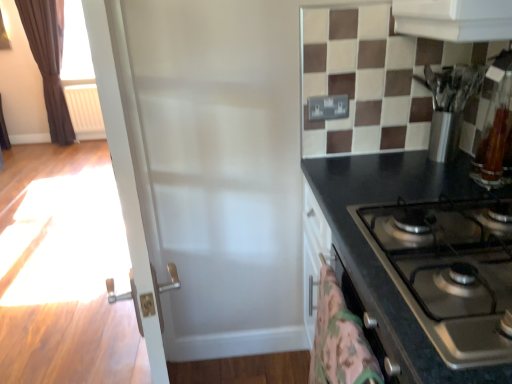
This screenshot has width=512, height=384. In order to click on white glossy door at center in this screenshot , I will do `click(126, 158)`.

What do you see at coordinates (377, 258) in the screenshot?
I see `black glossy countertop at right` at bounding box center [377, 258].

Identify the location of fluffy pink blanket at lower right. Image resolution: width=512 pixels, height=384 pixels. (340, 340).

You are a GUI agent. You are given a task and a screenshot of the screen. Output one action in this format:
    pyautogui.click(x=<x>, y=<y>)
    Task: Click on the stainless steel knife block at upper right
    
    Given the screenshot: What is the action you would take?
    pyautogui.click(x=449, y=105)

Considering the relative sizes of stainless steel knife block at upper right and fluffy pink blanket at lower right in the image provided, is stainless steel knife block at upper right bigger than fluffy pink blanket at lower right?

Yes.

Is stainless steel knife block at upper right looking in the opposite direction of fluffy pink blanket at lower right?

stainless steel knife block at upper right is not turned away from fluffy pink blanket at lower right.

From a real-world perspective, does stainless steel knife block at upper right sit lower than fluffy pink blanket at lower right?

Incorrect, from a real-world perspective, stainless steel knife block at upper right is higher than fluffy pink blanket at lower right.

Are white plastic radiator at left and fluffy pink blanket at lower right located far from each other?

Yes, white plastic radiator at left and fluffy pink blanket at lower right are quite far apart.

From the image's perspective, is white plastic radiator at left positioned above or below fluffy pink blanket at lower right?

From the image's perspective, white plastic radiator at left appears above fluffy pink blanket at lower right.

How distant is white plastic radiator at left from fluffy pink blanket at lower right?

white plastic radiator at left is 14.01 feet away from fluffy pink blanket at lower right.

Which is more to the right, white plastic radiator at left or fluffy pink blanket at lower right?

fluffy pink blanket at lower right is more to the right.

Between black glossy countertop at right and brown velvet curtain at left, which one has smaller width?

Thinner between the two is brown velvet curtain at left.

Is point (391, 319) closer to viewer compared to point (72, 128)?

Yes, it is.

Is black glossy countertop at right taller than brown velvet curtain at left?

In fact, black glossy countertop at right may be shorter than brown velvet curtain at left.

From a real-world perspective, which object rests below the other?

In real-world perspective, fluffy pink blanket at lower right is lower.

Could you tell me if fluffy pink blanket at lower right is turned towards white glossy door at center?

No, fluffy pink blanket at lower right is not facing towards white glossy door at center.

Can you tell me how much fluffy pink blanket at lower right and white glossy door at center differ in facing direction?

fluffy pink blanket at lower right and white glossy door at center are facing 13 degrees away from each other.

From the image's perspective, is fluffy pink blanket at lower right on white glossy door at center?

Actually, fluffy pink blanket at lower right appears below white glossy door at center in the image.

What's the angular difference between stainless steel knife block at upper right and black glossy countertop at right's facing directions?

They differ by 0.469 degrees in their facing directions.

Considering the sizes of stainless steel knife block at upper right and black glossy countertop at right in the image, is stainless steel knife block at upper right taller or shorter than black glossy countertop at right?

Considering their sizes, stainless steel knife block at upper right has less height than black glossy countertop at right.

Could you tell me if stainless steel knife block at upper right is facing black glossy countertop at right?

No, stainless steel knife block at upper right is not facing towards black glossy countertop at right.

Does stainless steel knife block at upper right have a smaller size compared to black glossy countertop at right?

Yes, stainless steel knife block at upper right is smaller than black glossy countertop at right.

Between black glossy countertop at right and white glossy door at center, which one is positioned in front?

Positioned in front is white glossy door at center.

Based on their sizes in the image, would you say black glossy countertop at right is bigger or smaller than white glossy door at center?

In the image, black glossy countertop at right appears to be larger than white glossy door at center.

From the picture: Does black glossy countertop at right have a greater width compared to white glossy door at center?

Yes, black glossy countertop at right is wider than white glossy door at center.

Are black glossy countertop at right and white glossy door at center beside each other?

black glossy countertop at right and white glossy door at center are clearly separated.

Which is more to the left, fluffy pink blanket at lower right or brown velvet curtain at left?

Positioned to the left is brown velvet curtain at left.

From the image's perspective, is fluffy pink blanket at lower right above or below brown velvet curtain at left?

fluffy pink blanket at lower right is below brown velvet curtain at left.

Does point (365, 363) appear closer or farther from the camera than point (53, 25)?

Point (365, 363) appears to be closer to the viewer than point (53, 25).

At what (x,y) coordinates should I click in order to perform the action: click on blanket below the stainless steel knife block at upper right (from the image's perspective). Please return your answer as a coordinate pair (x, y). Looking at the image, I should click on (340, 340).

The image size is (512, 384). Find the location of `blanket on the right of white plastic radiator at left`. blanket on the right of white plastic radiator at left is located at coordinates (340, 340).

Consider the image. Estimate the real-world distances between objects in this image. Which object is further from white glossy door at center, brown velvet curtain at left or stainless steel knife block at upper right?

brown velvet curtain at left is positioned further to the anchor white glossy door at center.

Based on their spatial positions, is black glossy countertop at right or fluffy pink blanket at lower right further from brown velvet curtain at left?

Based on the image, fluffy pink blanket at lower right appears to be further to brown velvet curtain at left.

Based on their spatial positions, is fluffy pink blanket at lower right or white glossy door at center further from white plastic radiator at left?

The object further to white plastic radiator at left is fluffy pink blanket at lower right.

In the scene shown: Which object lies nearer to the anchor point brown velvet curtain at left, stainless steel knife block at upper right or black glossy countertop at right?

Among the two, black glossy countertop at right is located nearer to brown velvet curtain at left.

From the image, which object appears to be nearer to white plastic radiator at left, black glossy countertop at right or white glossy door at center?

black glossy countertop at right is positioned closer to the anchor white plastic radiator at left.

Considering their positions, is white plastic radiator at left positioned closer to white glossy door at center than brown velvet curtain at left?

Based on the image, white plastic radiator at left appears to be nearer to white glossy door at center.

From the image, which object appears to be nearer to white plastic radiator at left, stainless steel knife block at upper right or fluffy pink blanket at lower right?

stainless steel knife block at upper right is positioned closer to the anchor white plastic radiator at left.

Considering their positions, is black glossy countertop at right positioned further to fluffy pink blanket at lower right than brown velvet curtain at left?

Among the two, brown velvet curtain at left is located further to fluffy pink blanket at lower right.

Find the location of a particular element. appliance between fluffy pink blanket at lower right and brown velvet curtain at left along the z-axis is located at coordinates click(x=449, y=105).

Where is `countertop between white glossy door at center and white plastic radiator at left along the z-axis`? The width and height of the screenshot is (512, 384). countertop between white glossy door at center and white plastic radiator at left along the z-axis is located at coordinates (377, 258).

Identify the location of blanket between white glossy door at center and black glossy countertop at right. (340, 340).

Find the location of a particular element. blanket between white glossy door at center and brown velvet curtain at left in the front-back direction is located at coordinates click(x=340, y=340).